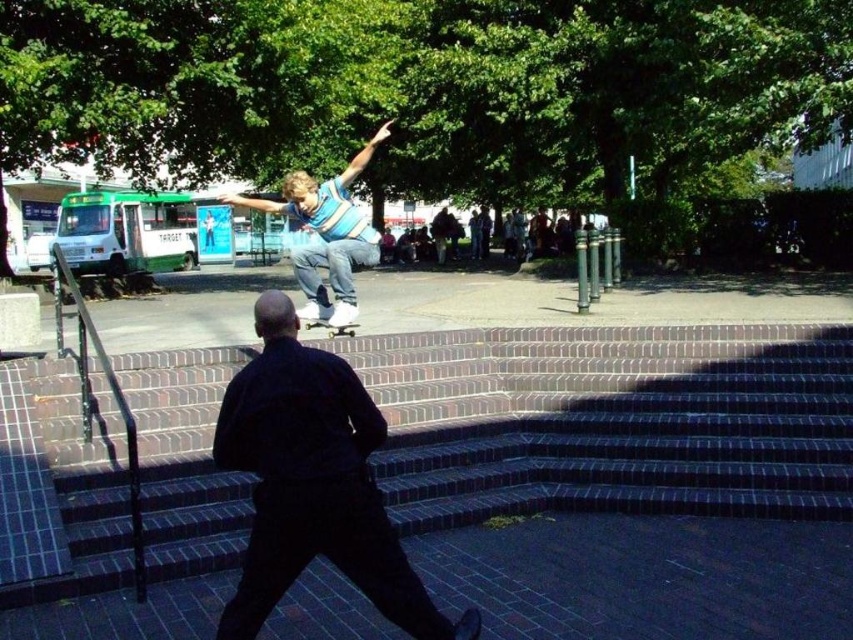
In the scene shown: Is dark brick stairs at center above denim jeans at center?

No, dark brick stairs at center is not above denim jeans at center.

Does point (445, 436) lie in front of point (263, 202)?

Yes, point (445, 436) is in front of point (263, 202).

Find the location of a particular element. This screenshot has width=853, height=640. dark brick stairs at center is located at coordinates (612, 420).

Between dark brick stairs at center and dark blue shirt at center, which one appears on the right side from the viewer's perspective?

dark brick stairs at center

Does dark brick stairs at center appear under dark blue shirt at center?

No, dark brick stairs at center is not below dark blue shirt at center.

The image size is (853, 640). In order to click on dark brick stairs at center in this screenshot , I will do `click(612, 420)`.

Who is positioned more to the left, dark blue shirt at center or wooden deck at center?

Positioned to the left is wooden deck at center.

Is point (236, 426) closer to viewer compared to point (309, 323)?

Yes, it is.

Between point (231, 433) and point (310, 317), which one is positioned behind?

The point (310, 317) is behind.

This screenshot has width=853, height=640. I want to click on dark blue shirt at center, so click(312, 483).